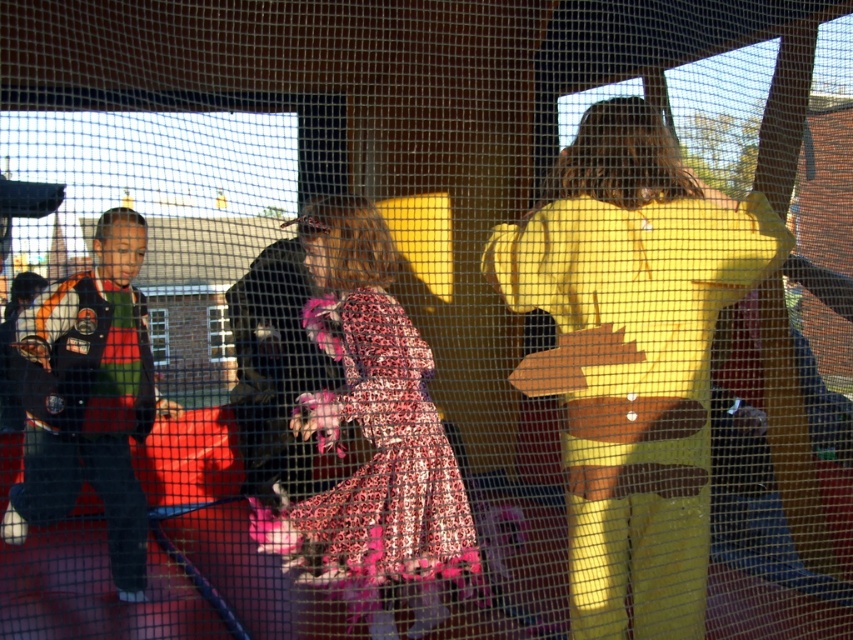
Question: Which point is closer to the camera?

Choices:
 (A) leopard print dress at center
 (B) matte black vest at left

Answer: (A)

Question: Can you confirm if leopard print dress at center is thinner than matte black vest at left?

Choices:
 (A) no
 (B) yes

Answer: (A)

Question: Which point appears closest to the camera in this image?

Choices:
 (A) (137, 387)
 (B) (364, 269)

Answer: (B)

Question: Which point is closer to the camera?

Choices:
 (A) leopard print dress at center
 (B) matte black vest at left

Answer: (A)

Question: Is leopard print dress at center bigger than matte black vest at left?

Choices:
 (A) no
 (B) yes

Answer: (B)

Question: Is leopard print dress at center above matte black vest at left?

Choices:
 (A) no
 (B) yes

Answer: (A)